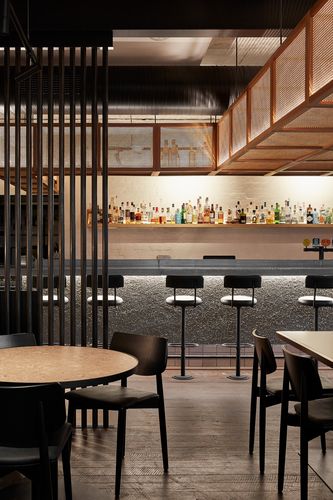
Locate an element on the screen. black chair is located at coordinates click(x=324, y=411), click(x=277, y=384), click(x=132, y=398), click(x=52, y=450), click(x=15, y=339).